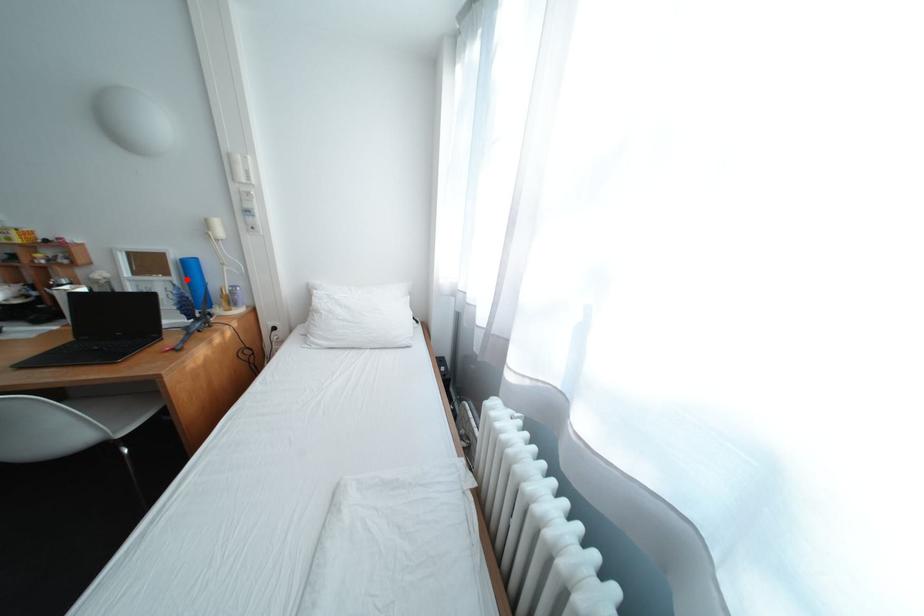
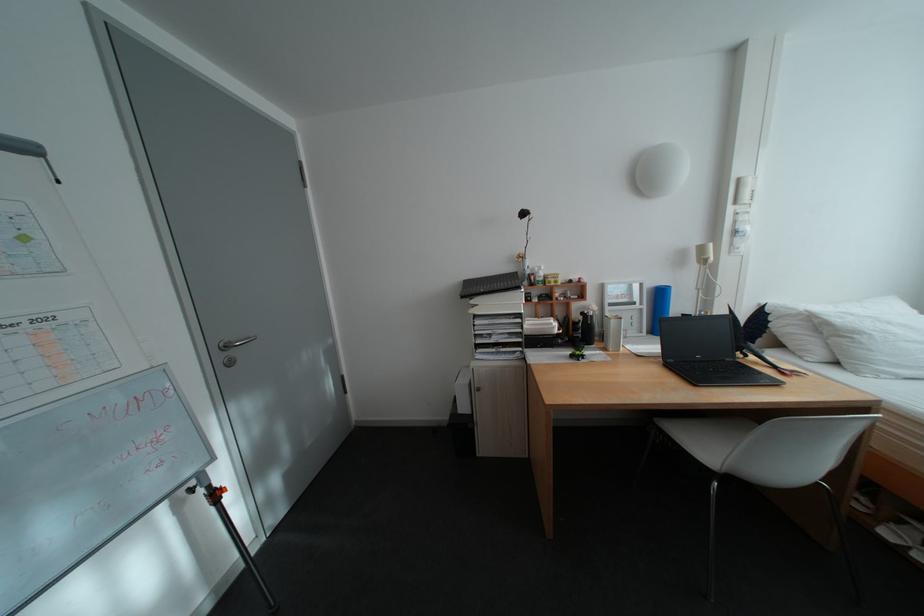
Locate, in the second image, the point that corresponds to the highlighted location in the first image.

(657, 307)